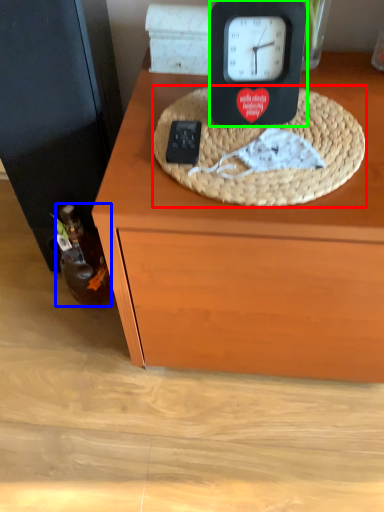
Question: Considering the real-world distances, which object is farthest from basket (highlighted by a red box)? bottle (highlighted by a blue box) or clock (highlighted by a green box)?

Choices:
 (A) bottle
 (B) clock

Answer: (A)